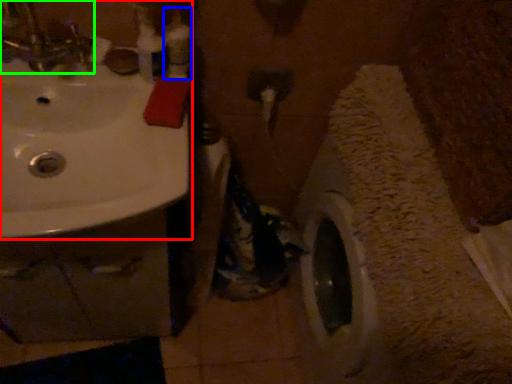
Question: Based on their relative distances, which object is farther from sink (highlighted by a red box)? Choose from toiletry (highlighted by a blue box) and tap (highlighted by a green box).

Choices:
 (A) toiletry
 (B) tap

Answer: (A)